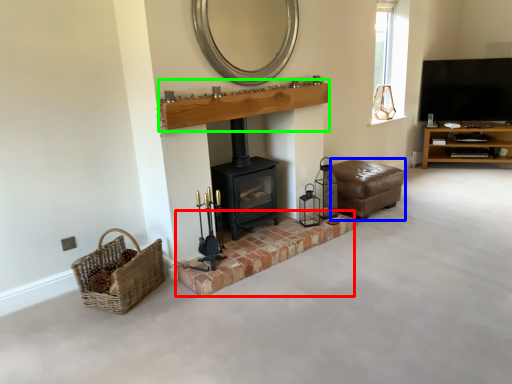
Question: Which object is the closest to the brickwork (highlighted by a red box)? Choose among these: armchair (highlighted by a blue box) or mantle (highlighted by a green box).

Choices:
 (A) armchair
 (B) mantle

Answer: (A)